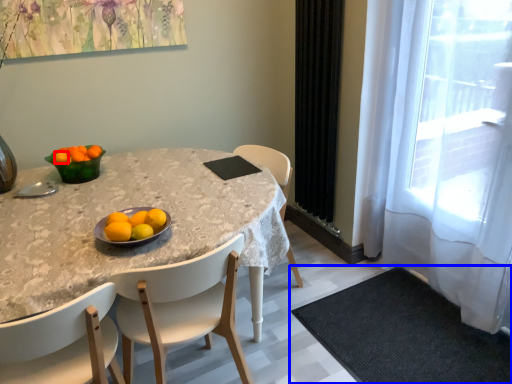
Question: Which object appears closest to the camera in this image, tangerine (highlighted by a red box) or place mat (highlighted by a blue box)?

Choices:
 (A) tangerine
 (B) place mat

Answer: (B)